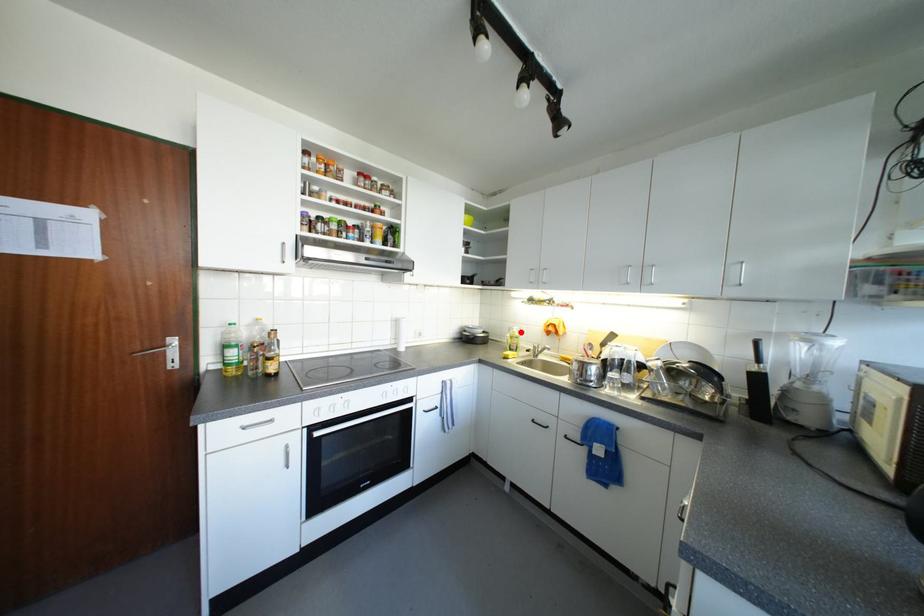
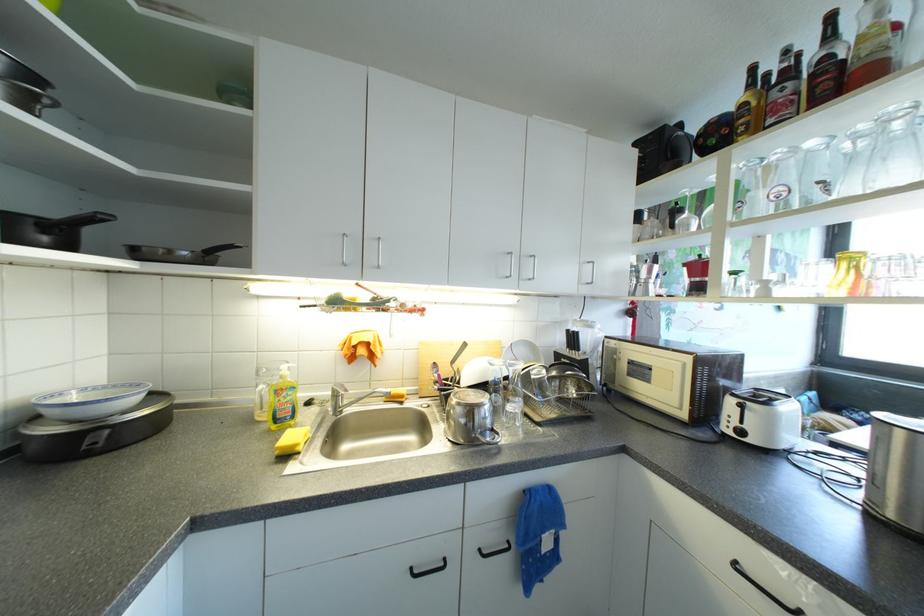
Locate, in the second image, the point that corresponds to the highlighted location in the first image.

(290, 373)